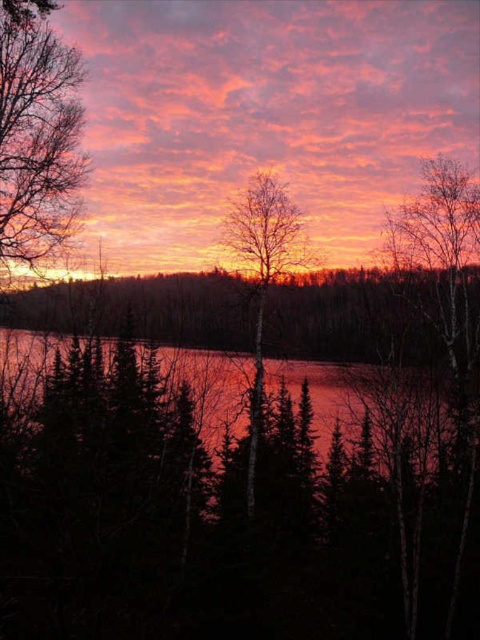
Question: Among these points, which one is farthest from the camera?

Choices:
 (A) (309, 372)
 (B) (254, 336)

Answer: (A)

Question: Is dark red water at center to the left of bare birch tree at center from the viewer's perspective?

Choices:
 (A) no
 (B) yes

Answer: (B)

Question: Can you confirm if dark red water at center is bigger than bare birch tree at center?

Choices:
 (A) yes
 (B) no

Answer: (A)

Question: Among these objects, which one is nearest to the camera?

Choices:
 (A) dark red water at center
 (B) bare birch tree at center

Answer: (A)

Question: Does dark red water at center appear on the right side of bare birch tree at center?

Choices:
 (A) yes
 (B) no

Answer: (B)